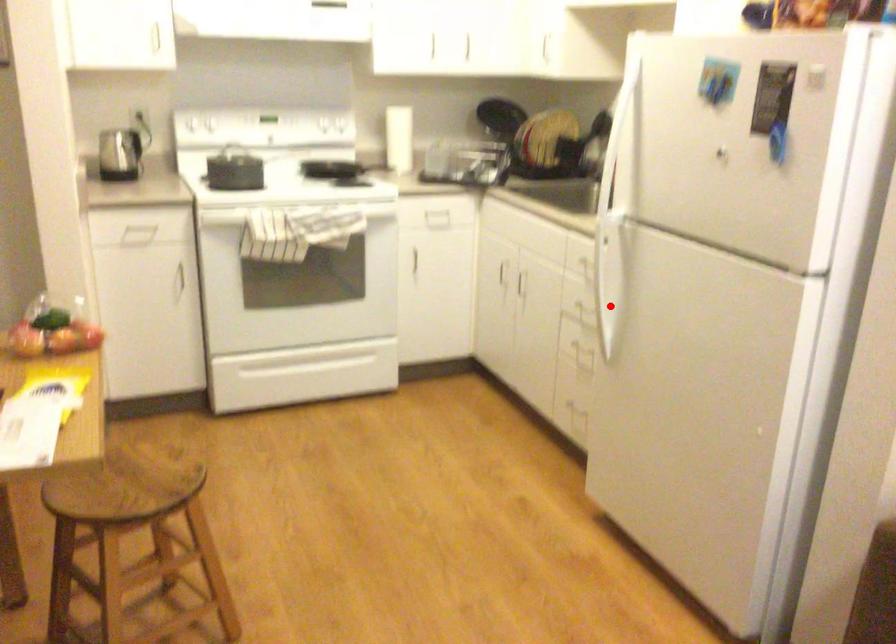
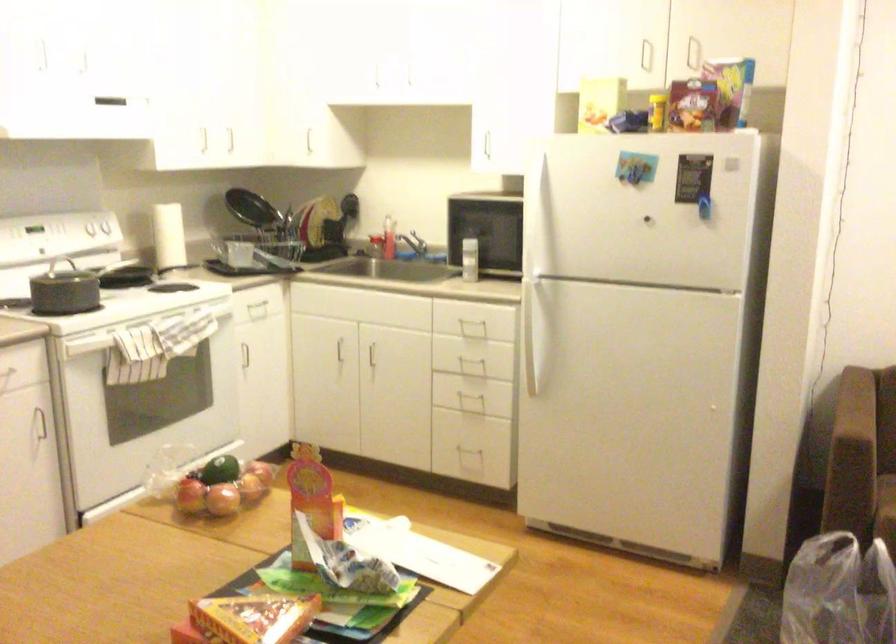
The point at the highlighted location is marked in the first image. Where is the corresponding point in the second image?

(536, 350)